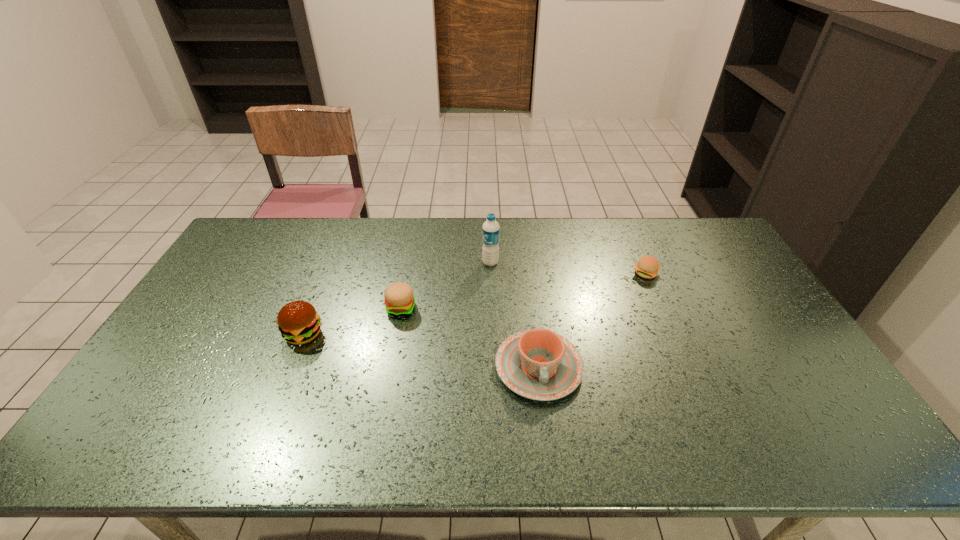
Where is `free location located on the label of the tallest object`? The height and width of the screenshot is (540, 960). free location located on the label of the tallest object is located at coordinates (392, 262).

This screenshot has height=540, width=960. I want to click on vacant space located 0.220m on the left of the leftmost hamburger, so click(206, 334).

The image size is (960, 540). In order to click on free region located on the handle side of the chinaware in this screenshot , I will do `click(546, 427)`.

This screenshot has height=540, width=960. What are the coordinates of `vacant space located on the back of the second shortest hamburger` in the screenshot? It's located at (416, 228).

Where is `free space located 0.280m on the back of the shortest hamburger`? This screenshot has height=540, width=960. free space located 0.280m on the back of the shortest hamburger is located at coordinates (622, 218).

In the image, there is a desktop. Identify the location of free space at the far edge. The image size is (960, 540). (569, 241).

Locate an element on the screen. The width and height of the screenshot is (960, 540). blank area at the near edge is located at coordinates (289, 424).

Image resolution: width=960 pixels, height=540 pixels. In order to click on vacant space at the left edge in this screenshot , I will do `click(216, 271)`.

Where is `vacant point at the right edge`? Image resolution: width=960 pixels, height=540 pixels. vacant point at the right edge is located at coordinates (732, 282).

At what (x,y) coordinates should I click in order to perform the action: click on empty location between the chinaware and the fourth object from right to left. Please return your answer as a coordinate pair (x, y). Looking at the image, I should click on (469, 338).